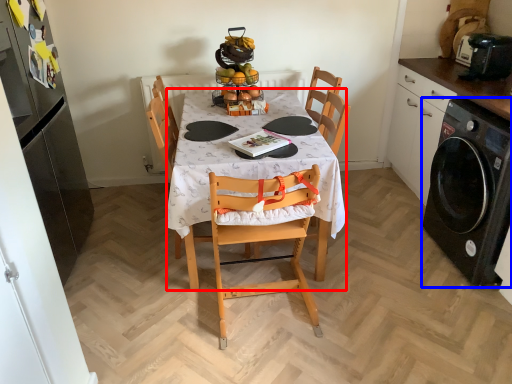
Question: Which point is closer to the camera, desk (highlighted by a red box) or kitchen appliance (highlighted by a blue box)?

Choices:
 (A) desk
 (B) kitchen appliance

Answer: (A)